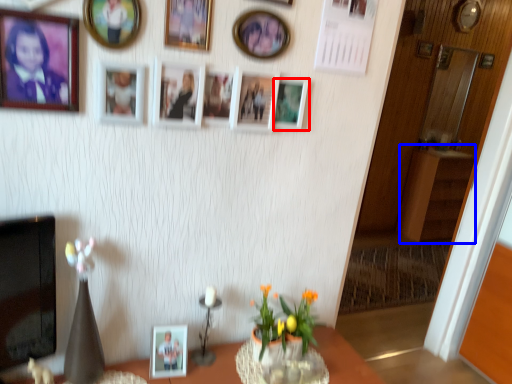
Question: Which of the following is the farthest to the observer, picture frame (highlighted by a red box) or dresser (highlighted by a blue box)?

Choices:
 (A) picture frame
 (B) dresser

Answer: (B)